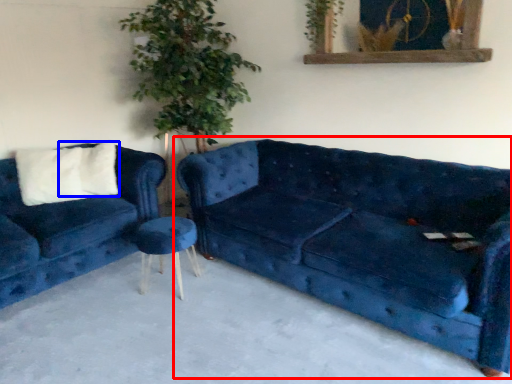
Question: Which object appears farthest to the camera in this image, studio couch (highlighted by a red box) or pillow (highlighted by a blue box)?

Choices:
 (A) studio couch
 (B) pillow

Answer: (B)